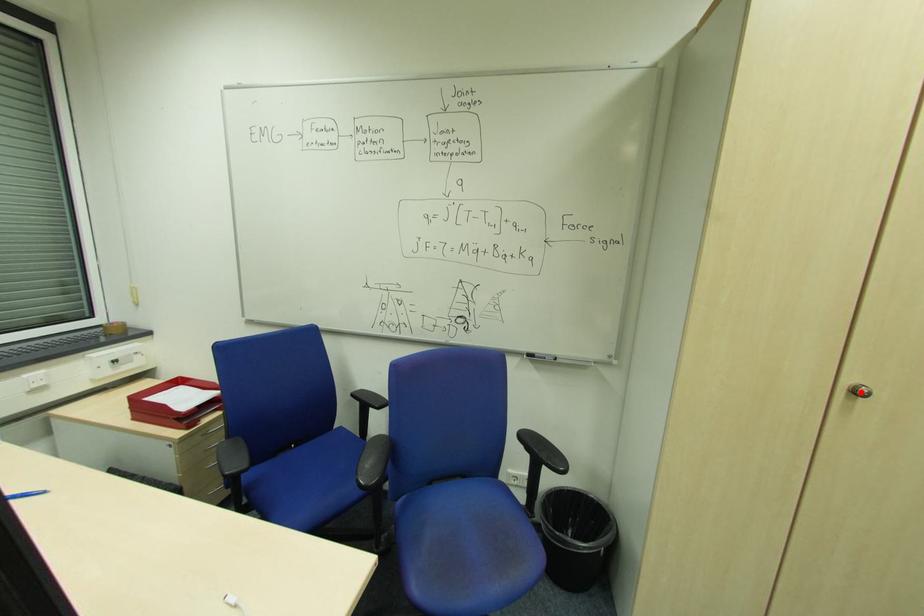
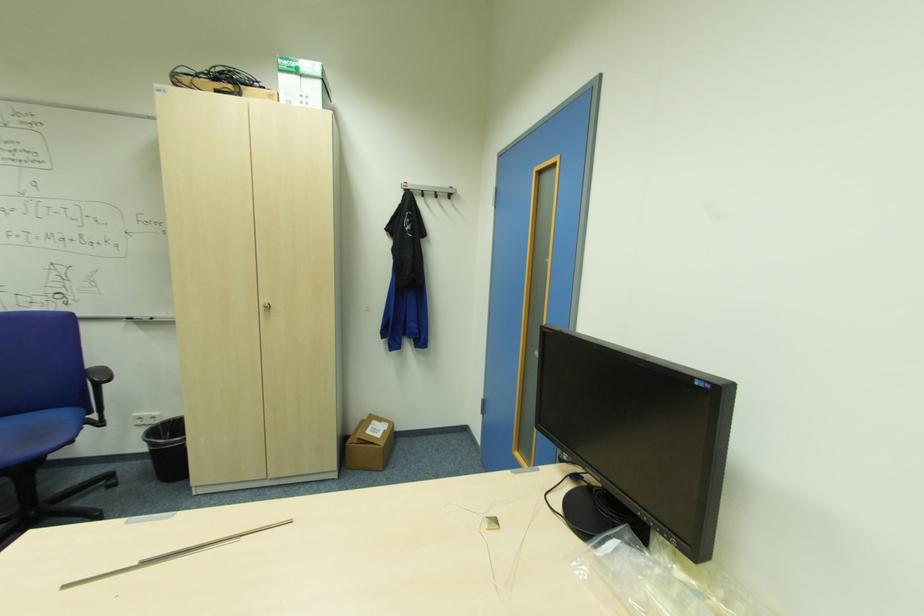
In the second image, find the point that corresponds to the highlighted location in the first image.

(271, 307)